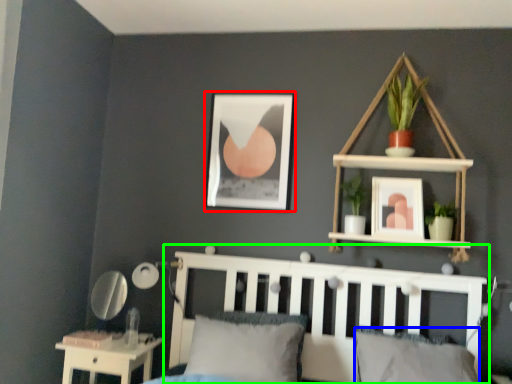
Question: Based on their relative distances, which object is farther from picture frame (highlighted by a red box)? Choose from pillow (highlighted by a blue box) and bed frame (highlighted by a green box).

Choices:
 (A) pillow
 (B) bed frame

Answer: (A)